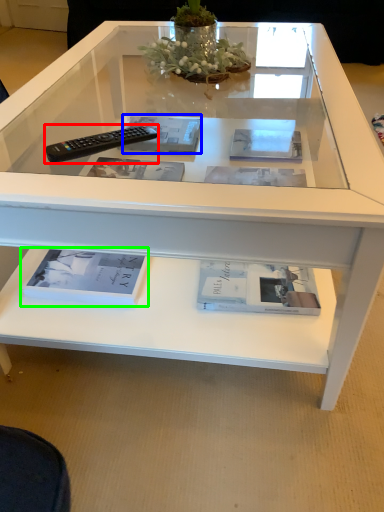
Question: Based on their relative distances, which object is farther from remote control (highlighted by a red box)? Choose from magazine (highlighted by a blue box) and book (highlighted by a green box).

Choices:
 (A) magazine
 (B) book

Answer: (B)